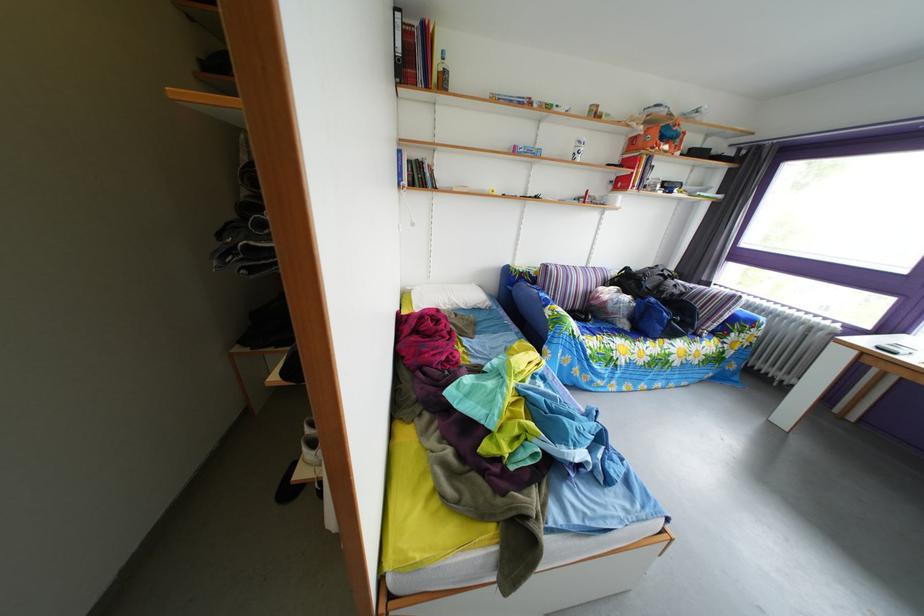
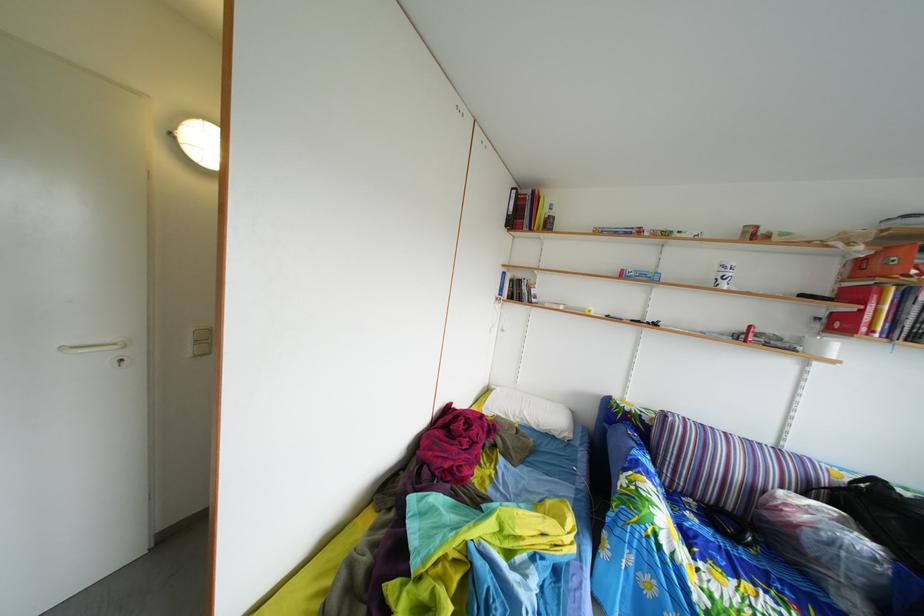
Find the pixel in the second image that matches pixel 585 152 in the first image.

(727, 276)